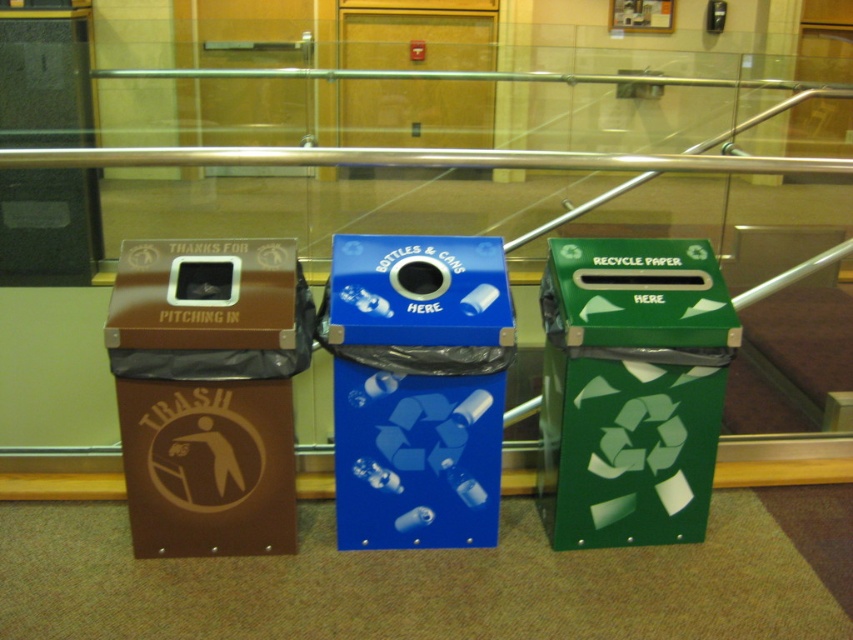
Question: Is the position of brown matte trash can at left more distant than that of green glossy recycle bin at right?

Choices:
 (A) no
 (B) yes

Answer: (A)

Question: Among these objects, which one is farthest from the camera?

Choices:
 (A) green glossy recycle bin at right
 (B) blue glossy plastic recycling bin at center
 (C) brown matte trash can at left

Answer: (A)

Question: Which point is farther to the camera?

Choices:
 (A) blue glossy plastic recycling bin at center
 (B) green glossy recycle bin at right

Answer: (B)

Question: Is brown matte trash can at left closer to camera compared to blue glossy plastic recycling bin at center?

Choices:
 (A) no
 (B) yes

Answer: (B)

Question: Which point is closer to the camera taking this photo?

Choices:
 (A) (614, 404)
 (B) (344, 477)

Answer: (A)

Question: Is brown matte trash can at left in front of blue glossy plastic recycling bin at center?

Choices:
 (A) no
 (B) yes

Answer: (B)